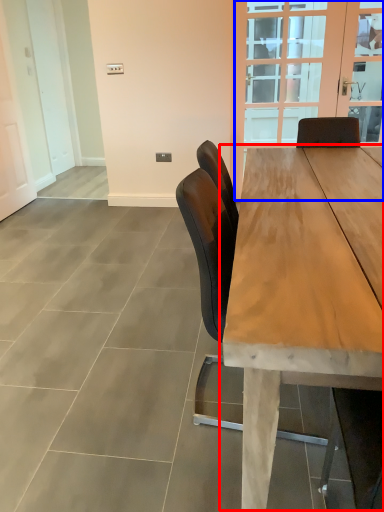
Question: Among these objects, which one is farthest to the camera, table (highlighted by a red box) or glass door (highlighted by a blue box)?

Choices:
 (A) table
 (B) glass door

Answer: (B)